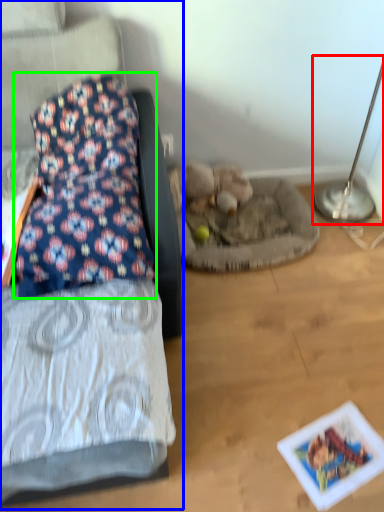
Question: Considering the real-world distances, which object is farthest from table lamp (highlighted by a red box)? furniture (highlighted by a blue box) or pillow (highlighted by a green box)?

Choices:
 (A) furniture
 (B) pillow

Answer: (B)